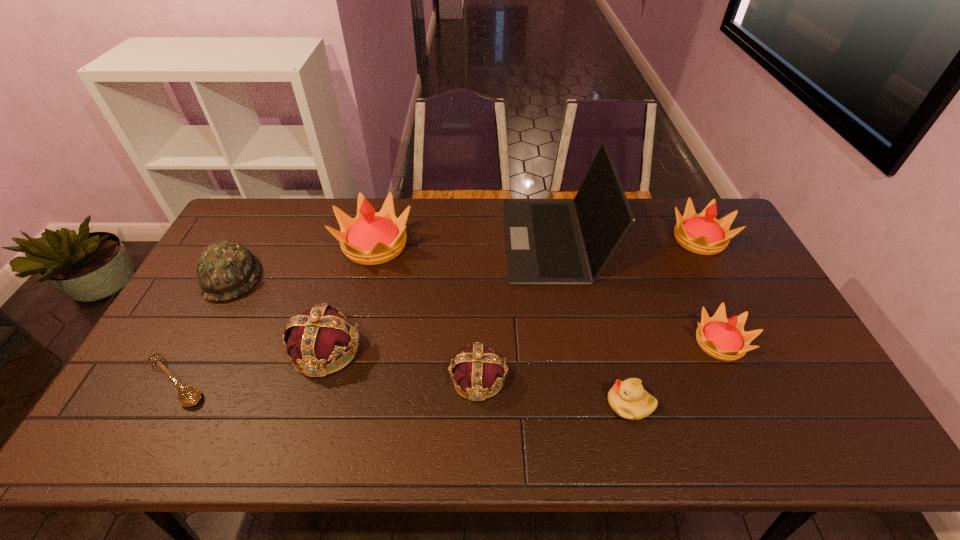
The height and width of the screenshot is (540, 960). Find the location of `free spot located on the left of the fifth object from right to left`. free spot located on the left of the fifth object from right to left is located at coordinates (301, 379).

Image resolution: width=960 pixels, height=540 pixels. Identify the location of free space located on the front-facing side of the duckling. (531, 403).

Image resolution: width=960 pixels, height=540 pixels. Identify the location of vacant space situated on the front-facing side of the duckling. click(445, 403).

Find the location of a particular element. The width and height of the screenshot is (960, 540). free space located on the front-facing side of the duckling is located at coordinates (515, 403).

You are a GUI agent. You are given a task and a screenshot of the screen. Output one action in this format:
    pyautogui.click(x=<x>, y=<y>)
    Task: Click on the vacant space located on the front of the ladle
    This screenshot has width=960, height=540.
    Given the screenshot: What is the action you would take?
    pyautogui.click(x=144, y=441)

Find the location of a particular element. This screenshot has height=540, width=960. laptop that is at the far edge is located at coordinates (548, 242).

This screenshot has width=960, height=540. I want to click on object that is at the near edge, so click(628, 399).

In order to click on headwear that is at the left edge in this screenshot , I will do `click(226, 269)`.

Where is `ladle at the left edge`? The image size is (960, 540). ladle at the left edge is located at coordinates (188, 396).

Where is `object that is at the far right corner`? This screenshot has width=960, height=540. object that is at the far right corner is located at coordinates (702, 233).